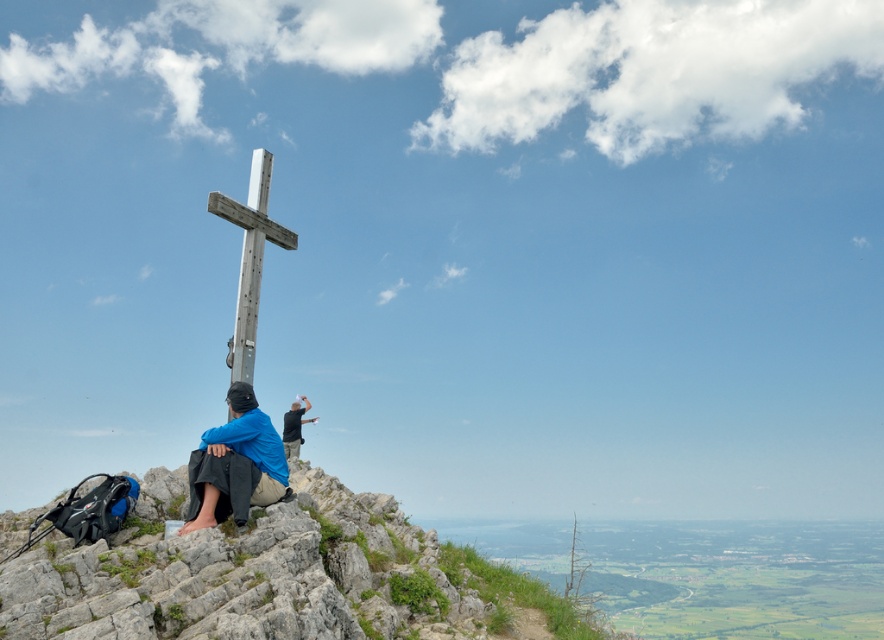
You are a hiker trying to reach the metallic silver cross at center from your current position near the gray rocky hillside at lower left. Which direction should you move to get closer to the cross?

The gray rocky hillside at lower left is closer to the viewer than the metallic silver cross at center, so you should move away from the gray rocky hillside at lower left towards the center of the scene to get closer to the metallic silver cross at center.

You are standing at the viewpoint in the image and want to move towards the two points marked in the scene. Which point, point (349, 621) or point (223, 436), would you reach first?

Point (349, 621) is closer to the viewer than point (223, 436), so you would reach point (349, 621) first.

You are planning to place a small flag on the gray rocky hillside at lower left. However, there is already a metallic silver cross at center. Based on their positions, can you determine if the flag will be visible from the cross?

The gray rocky hillside at lower left is positioned under the metallic silver cross at center, so placing the flag on the gray rocky hillside at lower left would likely make it visible from the cross as it is below it.